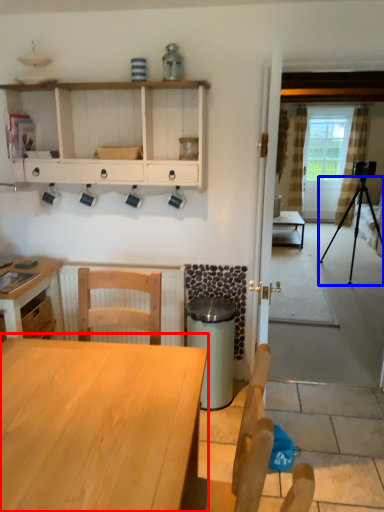
Question: Which point is closer to the camera, table (highlighted by a red box) or tripod (highlighted by a blue box)?

Choices:
 (A) table
 (B) tripod

Answer: (A)